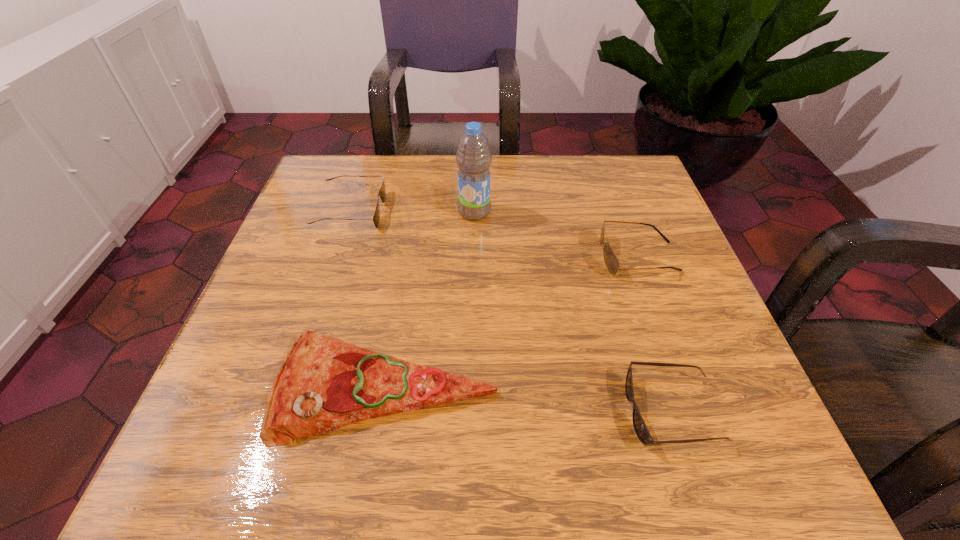
Locate an element on the screen. Image resolution: width=960 pixels, height=540 pixels. sunglasses present at the left edge is located at coordinates (382, 192).

Image resolution: width=960 pixels, height=540 pixels. Find the location of `pizza that is at the left edge`. pizza that is at the left edge is located at coordinates (324, 383).

The image size is (960, 540). What are the coordinates of `object positioned at the far left corner` in the screenshot? It's located at (382, 192).

Locate an element on the screen. Image resolution: width=960 pixels, height=540 pixels. object that is at the near left corner is located at coordinates (324, 383).

The width and height of the screenshot is (960, 540). I want to click on object positioned at the near right corner, so click(x=640, y=427).

In order to click on vacant space at the far edge of the desktop in this screenshot , I will do `click(509, 199)`.

In the image, there is a desktop. Where is `blank space at the near edge`? blank space at the near edge is located at coordinates click(545, 441).

Identify the location of vacant space at the left edge of the desktop. (243, 406).

Find the location of a particular element. This screenshot has width=960, height=540. vacant region at the right edge of the desktop is located at coordinates (600, 219).

Where is `vacant space at the far left corner of the desktop`? Image resolution: width=960 pixels, height=540 pixels. vacant space at the far left corner of the desktop is located at coordinates (372, 163).